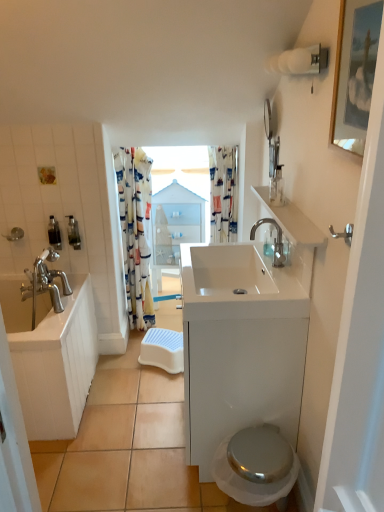
Question: From the image's perspective, is glossy glass mirror at upper right above satin nickel faucet at upper right?

Choices:
 (A) yes
 (B) no

Answer: (A)

Question: Is glossy glass mirror at upper right facing away from satin nickel faucet at upper right?

Choices:
 (A) no
 (B) yes

Answer: (A)

Question: Is glossy glass mirror at upper right further to the viewer compared to satin nickel faucet at upper right?

Choices:
 (A) no
 (B) yes

Answer: (B)

Question: From the image's perspective, is glossy glass mirror at upper right below satin nickel faucet at upper right?

Choices:
 (A) yes
 (B) no

Answer: (B)

Question: Is glossy glass mirror at upper right to the right of satin nickel faucet at upper right from the viewer's perspective?

Choices:
 (A) yes
 (B) no

Answer: (A)

Question: Based on their sizes in the image, would you say white glossy cabinet at center is bigger or smaller than metallic silver soap dispenser at left, acting as the 2th toiletry starting from the back?

Choices:
 (A) small
 (B) big

Answer: (B)

Question: From a real-world perspective, is white glossy cabinet at center physically located above or below metallic silver soap dispenser at left, acting as the 2th toiletry starting from the back?

Choices:
 (A) below
 (B) above

Answer: (A)

Question: From the image's perspective, is white glossy cabinet at center positioned above or below metallic silver soap dispenser at left, positioned as the second toiletry in front-to-back order?

Choices:
 (A) above
 (B) below

Answer: (B)

Question: In the image, is white glossy cabinet at center positioned in front of or behind metallic silver soap dispenser at left, acting as the 2th toiletry starting from the back?

Choices:
 (A) behind
 (B) front

Answer: (B)

Question: In the image, is printed fabric shower curtain at center, which is the first shower curtain from right to left, positioned in front of or behind white glossy cabinet at center?

Choices:
 (A) behind
 (B) front

Answer: (A)

Question: In terms of height, does printed fabric shower curtain at center, which is the first shower curtain from right to left, look taller or shorter compared to white glossy cabinet at center?

Choices:
 (A) tall
 (B) short

Answer: (B)

Question: From a real-world perspective, relative to white glossy cabinet at center, is printed fabric shower curtain at center, which is the first shower curtain from right to left, vertically above or below?

Choices:
 (A) above
 (B) below

Answer: (A)

Question: Is point (231, 174) positioned closer to the camera than point (211, 332)?

Choices:
 (A) farther
 (B) closer

Answer: (A)

Question: Choose the correct answer: Is clear glass jar at upper right, the 3th toiletry viewed from the back, inside white glossy bathtub at left or outside it?

Choices:
 (A) outside
 (B) inside

Answer: (A)

Question: In terms of size, does clear glass jar at upper right, arranged as the first toiletry when viewed from the right, appear bigger or smaller than white glossy bathtub at left?

Choices:
 (A) small
 (B) big

Answer: (A)